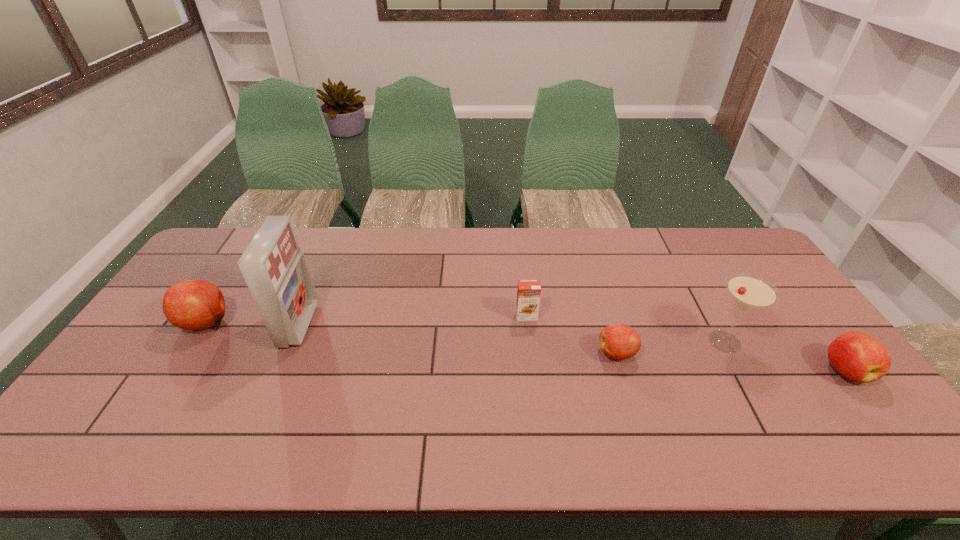
Find the location of a particular element. This screenshot has height=540, width=960. the leftmost apple is located at coordinates (193, 304).

I want to click on the tallest apple, so click(193, 304).

Find the location of `the shortest object`. the shortest object is located at coordinates (618, 341).

You are a GUI agent. You are given a task and a screenshot of the screen. Output one action in this format:
    pyautogui.click(x=<x>, y=<y>)
    Task: Click on the shortest apple
    This screenshot has width=960, height=540.
    Given the screenshot: What is the action you would take?
    pyautogui.click(x=618, y=341)

Identify the location of the rightmost object. The width and height of the screenshot is (960, 540). (859, 357).

At what (x,y) coordinates should I click in order to perform the action: click on the second shortest apple. Please return your answer as a coordinate pair (x, y). This screenshot has width=960, height=540. Looking at the image, I should click on click(x=859, y=357).

Find the location of a particular element. the third object from left to right is located at coordinates (528, 291).

Find the location of a particular element. the fifth shortest object is located at coordinates (749, 292).

The image size is (960, 540). Identify the location of martini. (749, 292).

Identify the location of the tallest object. (276, 272).